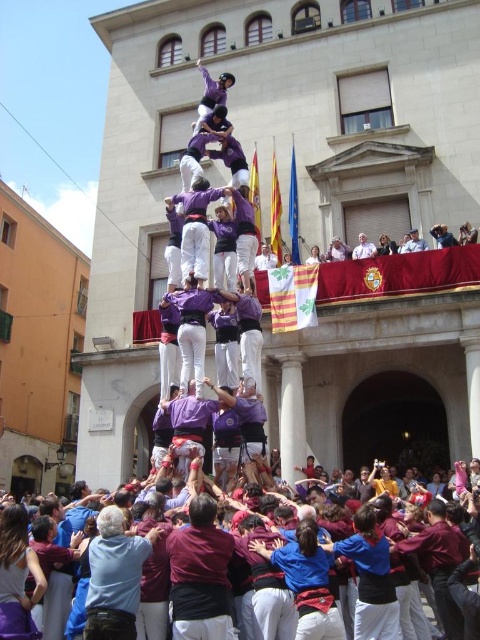
You are a photographer standing in front of the castell scene. You want to capture a photo that includes both the maroon fabric crowd at lower center and the purple cotton shirt at center. Which object should you focus on first to ensure both are in frame?

The maroon fabric crowd at lower center is larger in size than the purple cotton shirt at center, so you should focus on the maroon fabric crowd at lower center first to ensure both are in frame.

You are a photographer standing in front of the castell scene. You want to capture a photo that includes both the maroon fabric shirt at center and the light gray fabric at upper center. Which object should you focus on first to ensure both are in frame?

The maroon fabric shirt at center is much taller than the light gray fabric at upper center, so you should focus on the maroon fabric shirt at center first to ensure both are in frame.

You are a photographer trying to capture the human tower. You notice the maroon fabric shirt at center and the light gray fabric at upper center in your frame. Which object is wider in the image?

The maroon fabric shirt at center is wider than the light gray fabric at upper center.